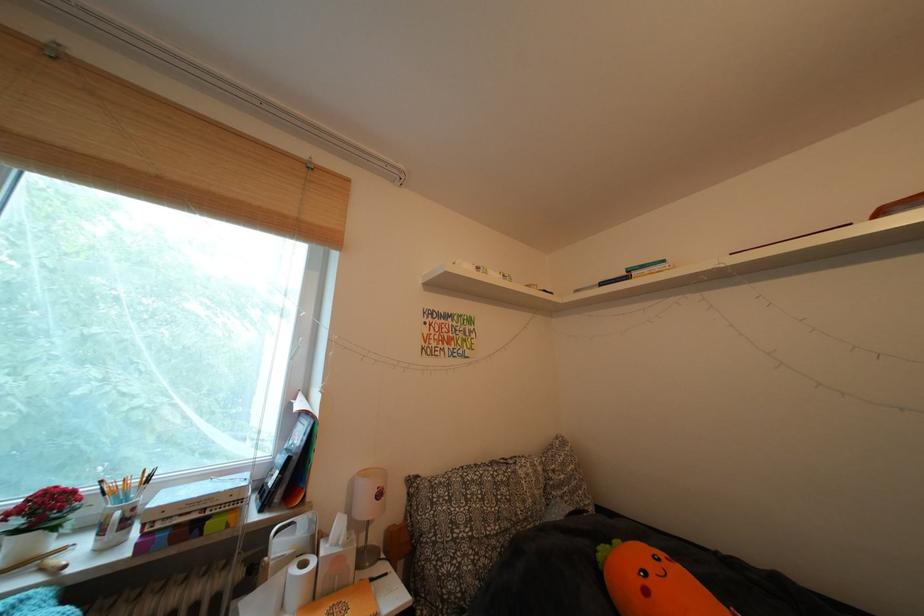
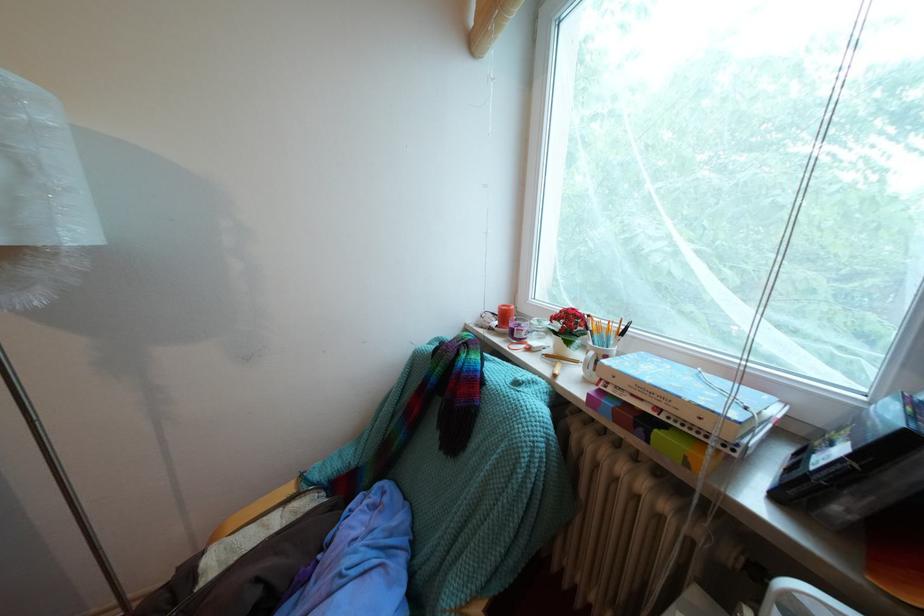
Question: How did the camera likely rotate?

Choices:
 (A) Left
 (B) Right
 (C) Up
 (D) Down

Answer: (A)